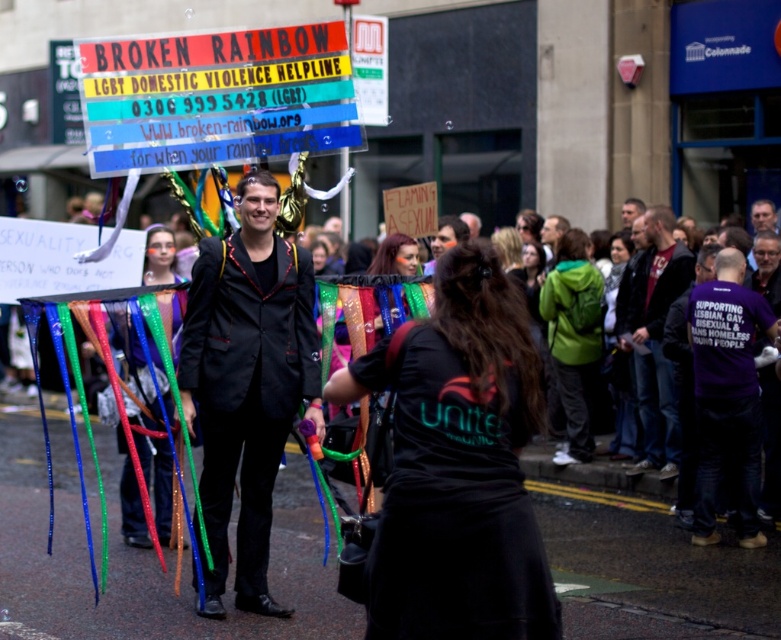
Which is below, dark blue t-shirt at center or matte black jacket at center?

dark blue t-shirt at center is below.

At what (x,y) coordinates should I click in order to perform the action: click on dark blue t-shirt at center. Please return your answer as a coordinate pair (x, y). The image size is (781, 640). Looking at the image, I should click on (655, 339).

Consider the image. Measure the distance between dark blue t-shirt at center and camera.

dark blue t-shirt at center is 11.63 meters from camera.

Locate an element on the screen. The image size is (781, 640). dark blue t-shirt at center is located at coordinates click(655, 339).

Which is in front, point (382, 627) or point (626, 413)?

Positioned in front is point (382, 627).

Can you confirm if black matte shirt at center is smaller than green fabric jacket at center?

Yes.

Is point (494, 445) positioned behind point (623, 234)?

No, (494, 445) is closer to viewer.

Locate an element on the screen. The width and height of the screenshot is (781, 640). black matte shirt at center is located at coordinates (457, 465).

Is black matte shirt at center smaller than purple fabric shirt at center-right?

No.

Locate an element on the screen. black matte shirt at center is located at coordinates (457, 465).